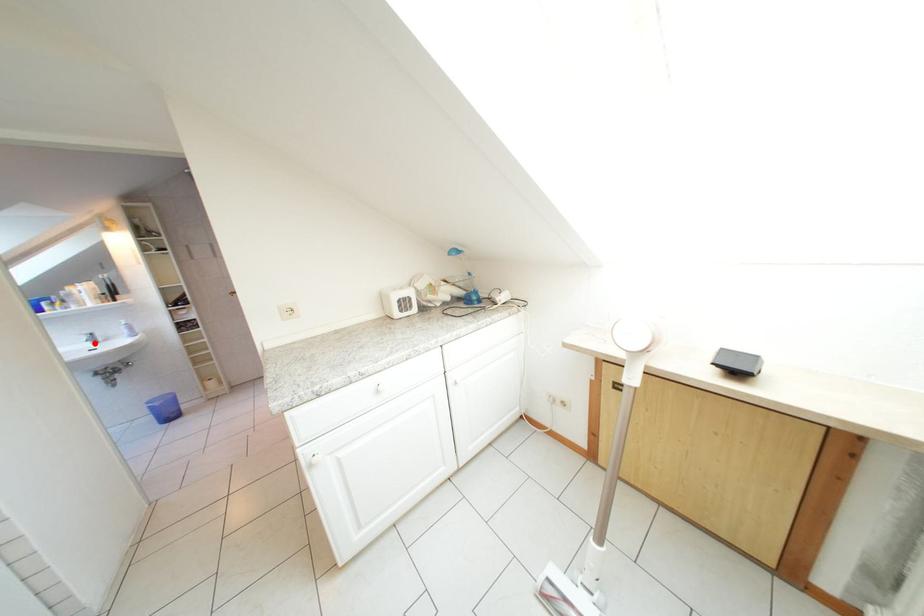
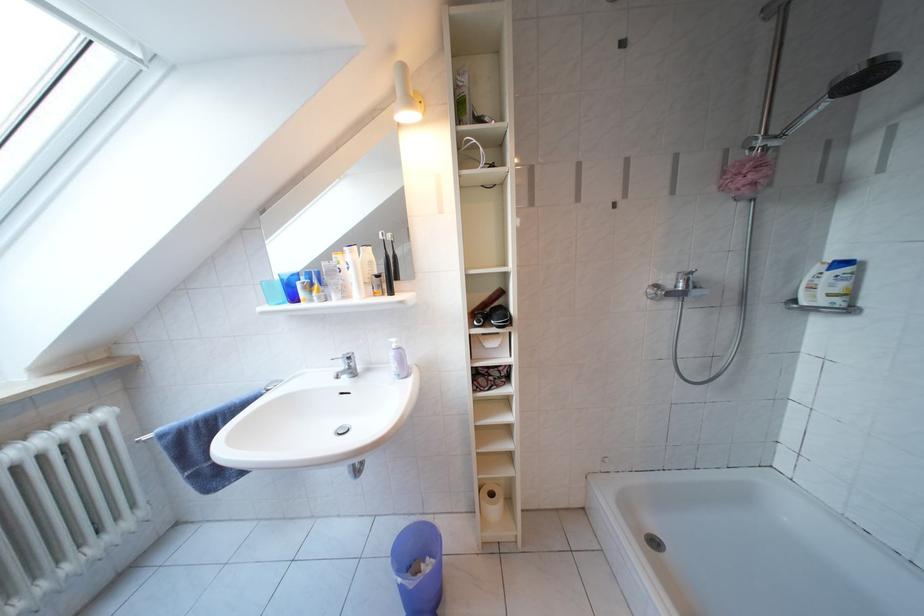
Where in the second image is the point corresponding to the highlighted location from the first image?

(349, 371)